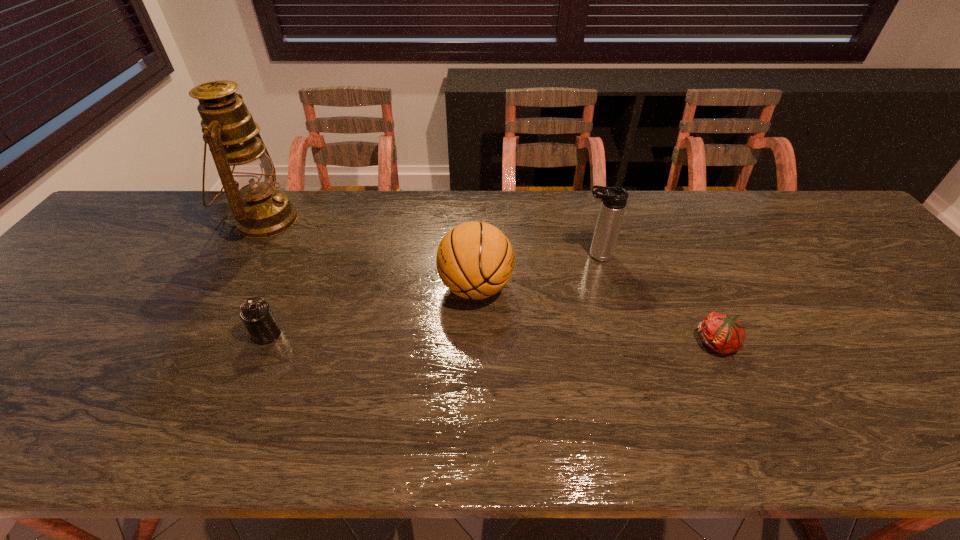
This screenshot has width=960, height=540. What are the coordinates of `free space between the basketball and the rightmost object` in the screenshot? It's located at (596, 315).

Where is `free spot between the rightmost object and the can`? The height and width of the screenshot is (540, 960). free spot between the rightmost object and the can is located at coordinates (492, 339).

Identify the location of unoccupied area between the thermos bottle and the rightmost object. (657, 299).

At what (x,y) coordinates should I click in order to perform the action: click on free space that is in between the thermos bottle and the oil lamp. Please return your answer as a coordinate pair (x, y). Looking at the image, I should click on (430, 238).

This screenshot has width=960, height=540. Find the location of `free space between the basketball and the fourth object from left to right`. free space between the basketball and the fourth object from left to right is located at coordinates (536, 271).

Where is `free area in between the tomato and the second object from right to left`? free area in between the tomato and the second object from right to left is located at coordinates (657, 299).

Where is `vacant area that lies between the shortest object and the third object from left to right`? Image resolution: width=960 pixels, height=540 pixels. vacant area that lies between the shortest object and the third object from left to right is located at coordinates (596, 315).

Where is `empty space that is in between the fourth object from left to right and the fourth tallest object`? empty space that is in between the fourth object from left to right and the fourth tallest object is located at coordinates (431, 294).

The image size is (960, 540). What are the coordinates of `free point between the tallest object and the fourth object from right to left` in the screenshot? It's located at (266, 277).

Locate an element on the screen. This screenshot has height=540, width=960. object that can be found as the second closest to the thermos bottle is located at coordinates (724, 334).